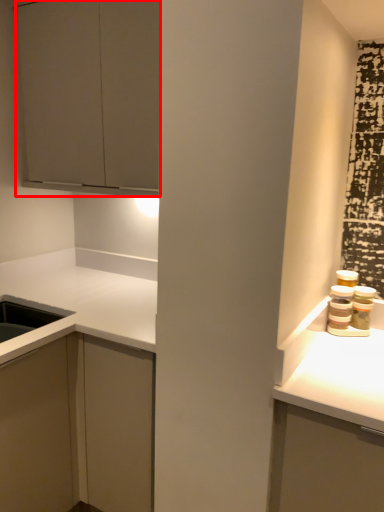
Question: From the image's perspective, where is cabinetry (annotated by the red box) located relative to cabinetry?

Choices:
 (A) above
 (B) below

Answer: (A)